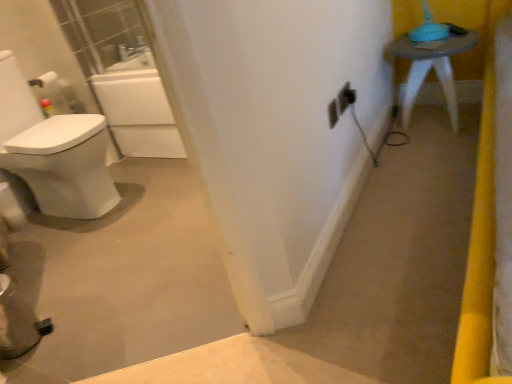
Find the location of a particular element. The height and width of the screenshot is (384, 512). free point below matte gray stool at upper right (from a real-world perspective) is located at coordinates (426, 121).